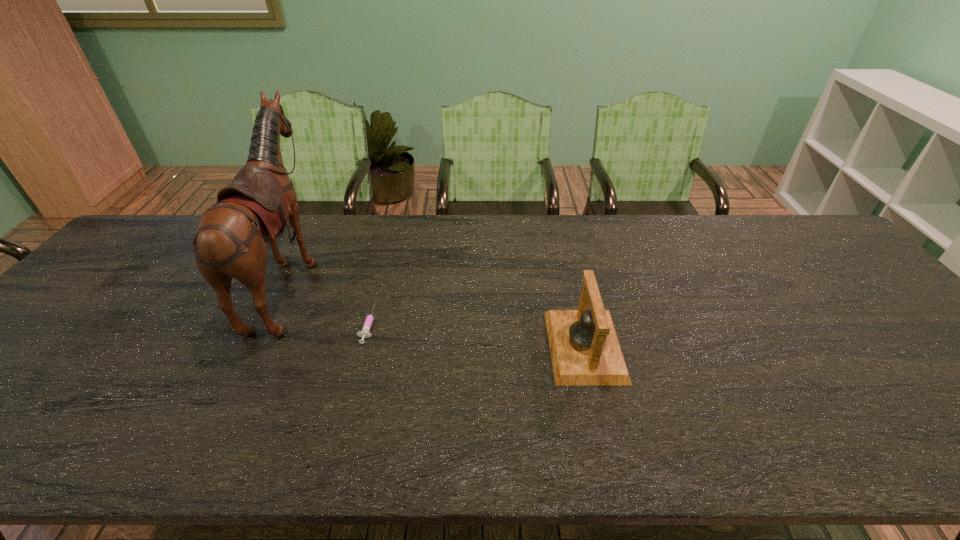
Locate an element on the screen. Image resolution: width=960 pixels, height=540 pixels. saddle is located at coordinates (257, 205).

The height and width of the screenshot is (540, 960). Find the location of `the tallest object`. the tallest object is located at coordinates (257, 205).

Locate an element on the screen. The image size is (960, 540). the rightmost object is located at coordinates (585, 351).

The image size is (960, 540). In order to click on the second tallest object in this screenshot , I will do `click(585, 351)`.

Identify the location of the shortest object. The width and height of the screenshot is (960, 540). (364, 333).

In order to click on syringe in this screenshot , I will do `click(364, 333)`.

The height and width of the screenshot is (540, 960). Find the location of `blank space located 0.380m on the back of the tallest object`. blank space located 0.380m on the back of the tallest object is located at coordinates (450, 280).

At what (x,y) coordinates should I click in order to perform the action: click on free spot located on the right of the second shortest object. Please return your answer as a coordinate pair (x, y). This screenshot has width=960, height=540. Looking at the image, I should click on (658, 346).

Image resolution: width=960 pixels, height=540 pixels. I want to click on vacant space situated on the left of the syringe, so click(x=295, y=324).

Locate an element on the screen. This screenshot has width=960, height=540. object located in the far edge section of the desktop is located at coordinates (257, 205).